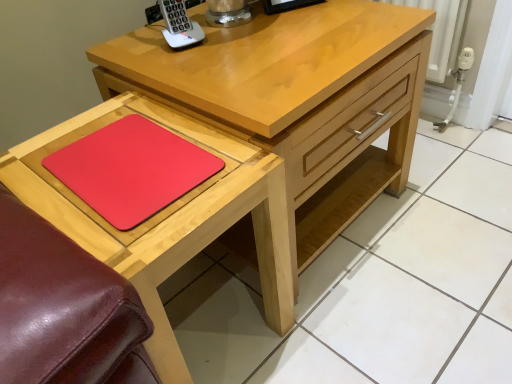
Where is `vacant space to the left of white plastic phone at upper center`? The image size is (512, 384). vacant space to the left of white plastic phone at upper center is located at coordinates tap(137, 54).